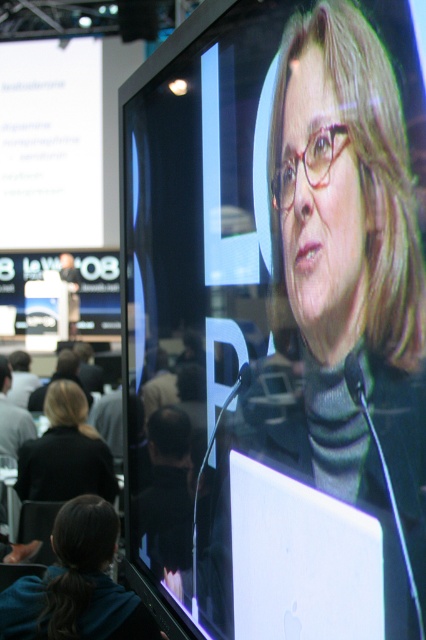
Question: Is the position of white glossy laptop at center less distant than that of blonde hair at lower left?

Choices:
 (A) yes
 (B) no

Answer: (A)

Question: Which of the following is the farthest from the observer?

Choices:
 (A) white glossy laptop at center
 (B) blonde hair at lower left

Answer: (B)

Question: Can you confirm if white glossy laptop at center is positioned above blonde hair at lower left?

Choices:
 (A) no
 (B) yes

Answer: (B)

Question: Which point is farther to the camera?

Choices:
 (A) white glossy laptop at center
 (B) blonde hair at lower left

Answer: (B)

Question: Can you confirm if white glossy laptop at center is smaller than blonde hair at lower left?

Choices:
 (A) no
 (B) yes

Answer: (A)

Question: Which of the following is the closest to the observer?

Choices:
 (A) white glossy laptop at center
 (B) blonde hair at lower left

Answer: (A)